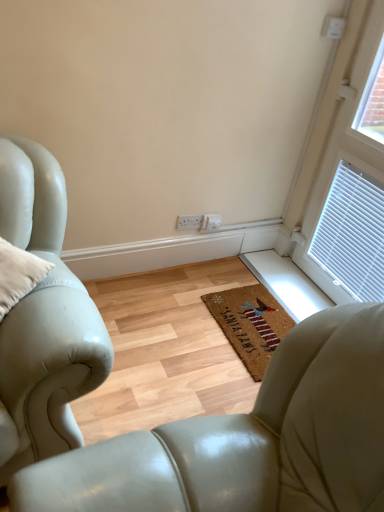
Where is `free space in front of coir mat at center`? free space in front of coir mat at center is located at coordinates (218, 378).